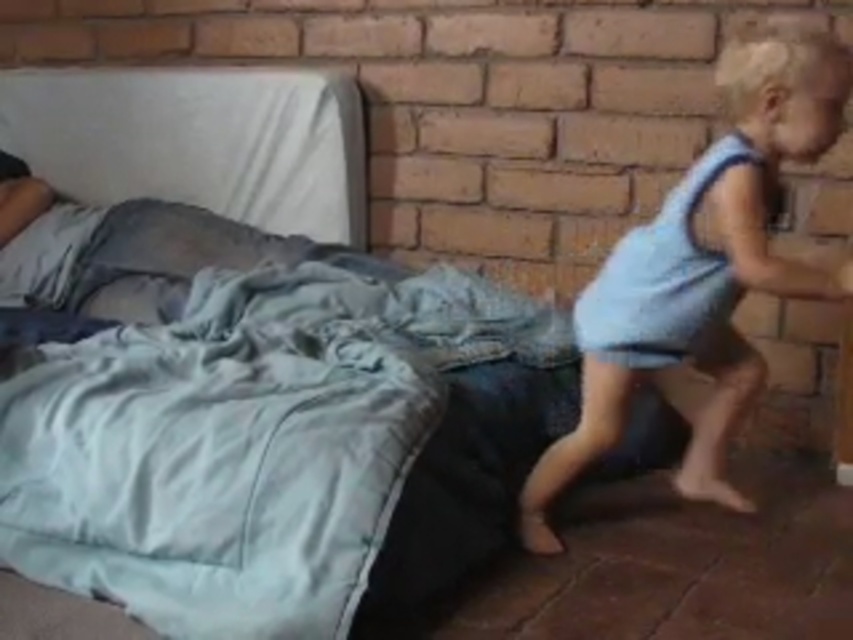
Is silky blue blanket at center to the right of light blue fabric at right from the viewer's perspective?

No, silky blue blanket at center is not to the right of light blue fabric at right.

Is point (437, 406) closer to viewer compared to point (654, 360)?

Yes, point (437, 406) is in front of point (654, 360).

This screenshot has height=640, width=853. What are the coordinates of `silky blue blanket at center` in the screenshot? It's located at (281, 444).